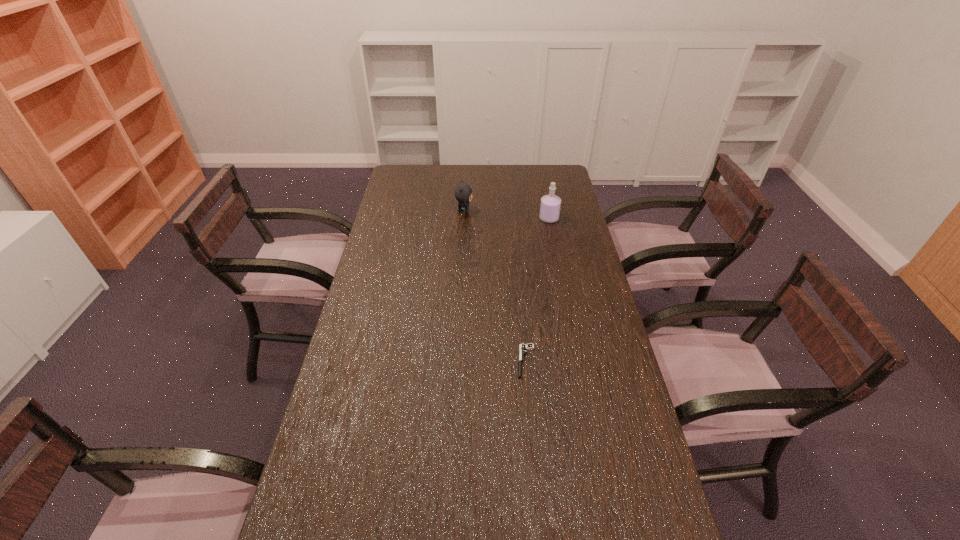
Locate an element on the screen. This screenshot has width=960, height=540. vacant point located on the front-facing side of the second object from right to left is located at coordinates (423, 361).

The width and height of the screenshot is (960, 540). Identify the location of object located at the right edge. (550, 205).

Where is `vacant area at the far edge`? The height and width of the screenshot is (540, 960). vacant area at the far edge is located at coordinates (436, 167).

Identify the location of vacant space at the left edge. (372, 248).

This screenshot has height=540, width=960. I want to click on vacant area at the right edge, so click(615, 382).

Where is `vacant space at the far left corner`? vacant space at the far left corner is located at coordinates tap(422, 165).

Locate an element on the screen. vacant area between the second object from right to left and the second tallest object is located at coordinates (495, 286).

This screenshot has height=540, width=960. Find the location of `free point between the rightmost object and the kitten`. free point between the rightmost object and the kitten is located at coordinates (507, 215).

Find the location of a particular element. free area in between the nearest object and the tallest object is located at coordinates (538, 290).

At what (x,y) coordinates should I click in order to perform the action: click on vacant region between the second object from right to left and the leftmost object. Please return your answer as a coordinate pair (x, y). This screenshot has width=960, height=540. Looking at the image, I should click on (495, 286).